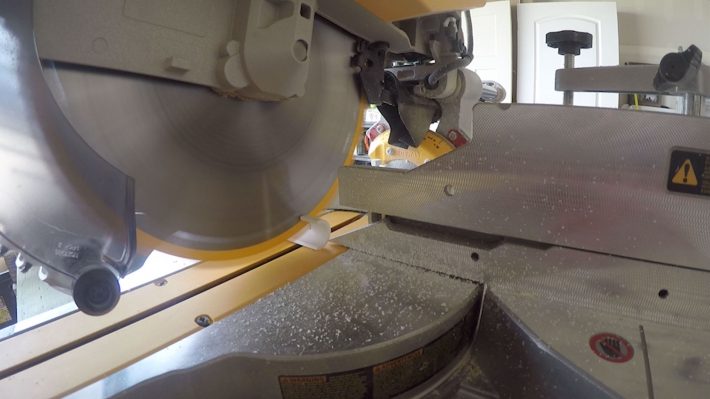
Image resolution: width=710 pixels, height=399 pixels. In order to click on ceiling in this screenshot , I will do `click(654, 14)`.